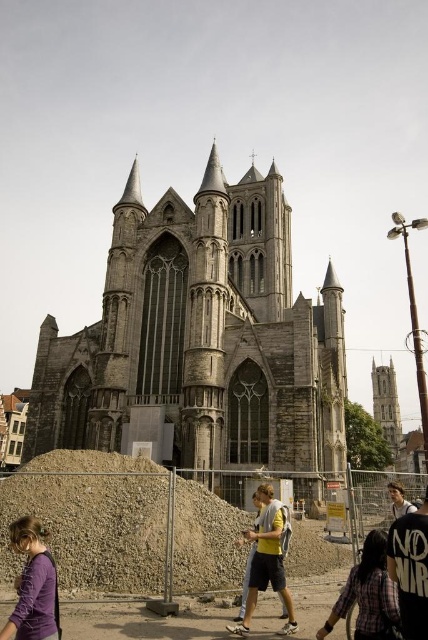
Who is positioned more to the right, gravel pile at center or purple soft fabric at lower left?

Positioned to the right is gravel pile at center.

Does gravel pile at center come behind purple soft fabric at lower left?

Yes, it is.

I want to click on gravel pile at center, so click(x=92, y=520).

Image resolution: width=428 pixels, height=640 pixels. In order to click on gravel pile at center in this screenshot , I will do `click(92, 520)`.

From the picture: Which is below, purple soft fabric at lower left or yellow fabric backpack at center?

yellow fabric backpack at center

Is point (26, 538) farther from camera compared to point (270, 499)?

No, (26, 538) is closer to viewer.

Identify the location of purple soft fabric at lower left. This screenshot has height=640, width=428. (32, 586).

Can you confirm if gravelly dirt mound at lower center is smaller than purple soft fabric at lower left?

Actually, gravelly dirt mound at lower center might be larger than purple soft fabric at lower left.

Find the location of a particular element. Image resolution: width=428 pixels, height=640 pixels. gravelly dirt mound at lower center is located at coordinates (92, 518).

This screenshot has height=640, width=428. I want to click on gravelly dirt mound at lower center, so click(x=92, y=518).

Identify the location of gravelly dirt mound at lower center. [92, 518].